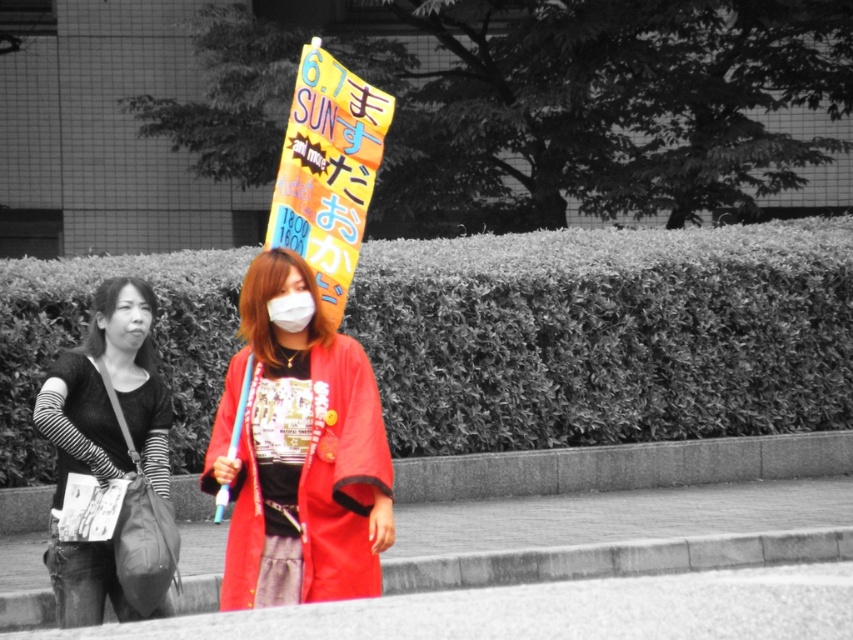
You are an event planner trying to set up a booth. You have a matte red kimono at center and a bright orange paper sign at center. Which item should you place first if you want to ensure there is enough space for both items side by side?

The matte red kimono at center might be wider than bright orange paper sign at center, so you should place the matte red kimono at center first to ensure there is enough space for both items side by side.

You are a photographer who wants to capture the striped fabric sweater at left in the image. Where exactly should you focus your camera lens to ensure it is centered in the frame?

You should focus your camera lens on the coordinates point at (103,440) to center the striped fabric sweater at left in the frame.

You are a photographer trying to capture the bright orange paper sign at center and the striped fabric sweater at left in a single frame. Based on their positions, can you ensure both are fully visible in the photo without moving the camera?

The striped fabric sweater at left is located below the bright orange paper sign at center, so adjusting the camera angle to include both the lower and upper areas should allow both to be visible in the photo.